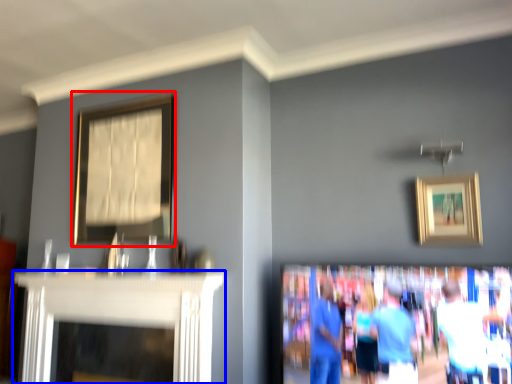
Question: Which point is closer to the camera, picture frame (highlighted by a red box) or fireplace (highlighted by a blue box)?

Choices:
 (A) picture frame
 (B) fireplace

Answer: (B)